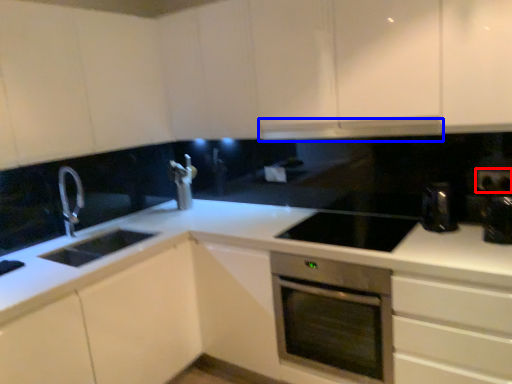
Question: Which object appears closest to the camera in this image, electric outlet (highlighted by a red box) or exhaust hood (highlighted by a blue box)?

Choices:
 (A) electric outlet
 (B) exhaust hood

Answer: (B)